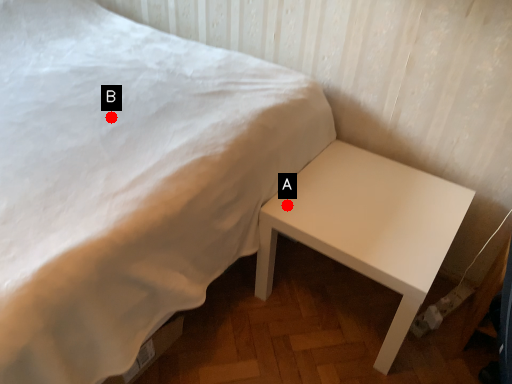
Question: Two points are circled on the image, labeled by A and B beside each circle. Which point is further to the camera?

Choices:
 (A) A is further
 (B) B is further

Answer: (A)